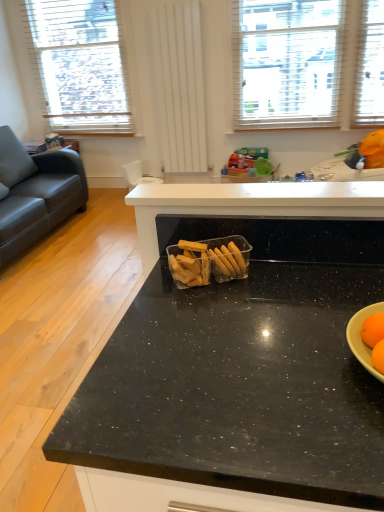
Question: Choose the correct answer: Is white wooden blinds at upper left, acting as the first window starting from the left, inside translucent plastic container of crackers at center or outside it?

Choices:
 (A) outside
 (B) inside

Answer: (A)

Question: From the image's perspective, is white wooden blinds at upper left, acting as the first window starting from the left, positioned above or below translucent plastic container of crackers at center?

Choices:
 (A) below
 (B) above

Answer: (B)

Question: Which of these objects is positioned closest to the white textured window at upper center, the first window when ordered from right to left?

Choices:
 (A) white wooden blinds at upper left, acting as the first window starting from the left
 (B) translucent plastic container of crackers at center

Answer: (A)

Question: Estimate the real-world distances between objects in this image. Which object is closer to the white textured window at upper center, the first window when ordered from right to left?

Choices:
 (A) translucent plastic container of crackers at center
 (B) white wooden blinds at upper left, which is the second window from right to left

Answer: (B)